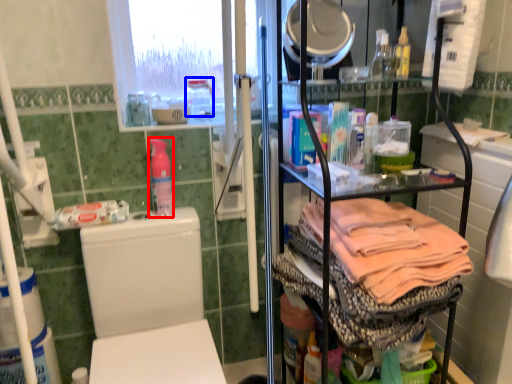
Question: Which object is closer to the camera taking this photo, bottle (highlighted by a red box) or bottle (highlighted by a blue box)?

Choices:
 (A) bottle
 (B) bottle

Answer: (A)